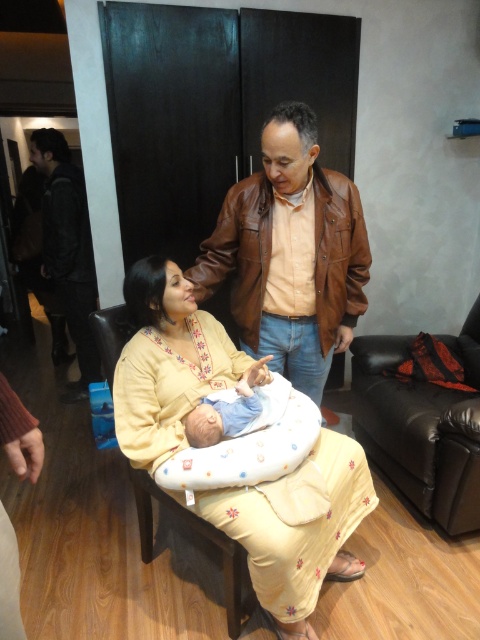
You are a fashion designer observing the scene. You need to determine which garment has a greater width between the yellow embroidered dress at center and the black leather jacket at left. Which one is wider?

The yellow embroidered dress at center is wider than the black leather jacket at left.

What is the spatial relationship between the black leather armchair at right and the black leather jacket at left in the scene?

The black leather armchair at right is located to the right of the black leather jacket at left.

You are a delivery person who needs to place a package between the black leather jacket at left and the blue cotton newborn at center. The package requires 6 feet of space. Can you fit it there?

The distance between the black leather jacket at left and the blue cotton newborn at center is 6.05 feet, so yes, the package can fit as there is sufficient space.